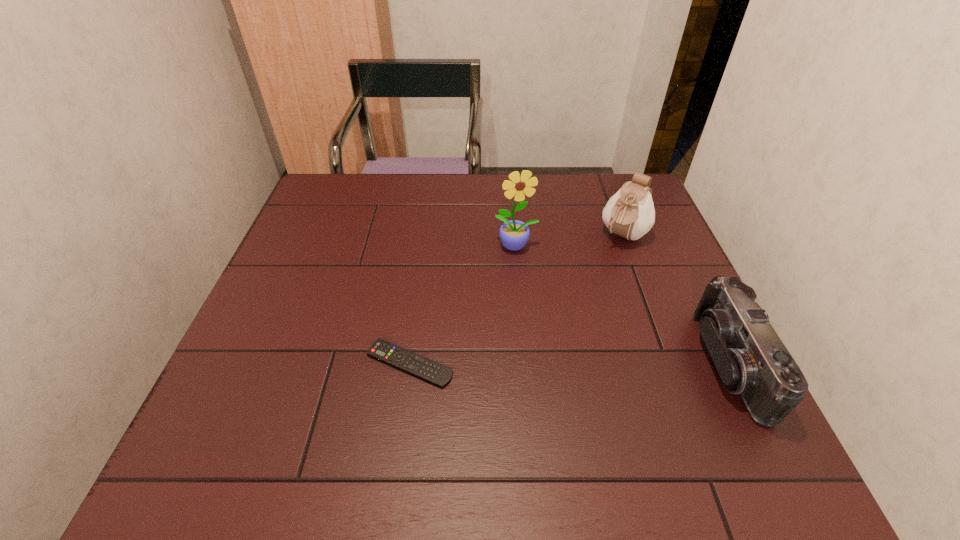
Identify the location of free space between the second tallest object and the third object from right to left. Image resolution: width=960 pixels, height=540 pixels. (569, 241).

This screenshot has height=540, width=960. Identify the location of vacant area between the third object from left to right and the camcorder. (676, 299).

At what (x,y) coordinates should I click in order to perform the action: click on vacant area that lies between the rightmost object and the shortest object. Please return your answer as a coordinate pair (x, y). This screenshot has height=540, width=960. Looking at the image, I should click on (569, 363).

Image resolution: width=960 pixels, height=540 pixels. What are the coordinates of `vacant space that's between the second object from left to right and the shortest object` in the screenshot? It's located at (463, 305).

The width and height of the screenshot is (960, 540). In order to click on vacant space that is in between the rightmost object and the pouch in this screenshot , I will do `click(676, 299)`.

Find the location of a particular element. free space between the third object from right to left and the rightmost object is located at coordinates (622, 305).

I want to click on free space that is in between the sunflower and the camcorder, so click(x=622, y=305).

Locate an element on the screen. empty location between the rightmost object and the third object from left to right is located at coordinates (676, 299).

Locate an element on the screen. Image resolution: width=960 pixels, height=540 pixels. blank region between the camcorder and the third object from left to right is located at coordinates (676, 299).

Find the location of `empty location between the camcorder and the third object from left to right`. empty location between the camcorder and the third object from left to right is located at coordinates (676, 299).